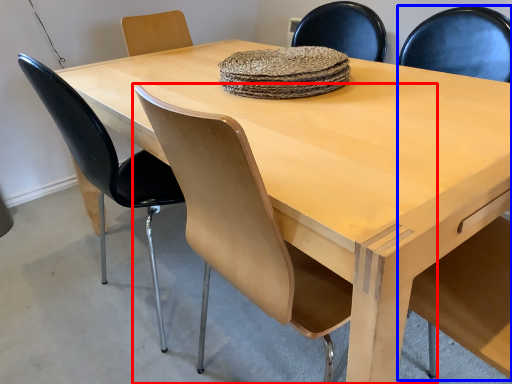
Question: Which object is further to the camera taking this photo, chair (highlighted by a red box) or armchair (highlighted by a blue box)?

Choices:
 (A) chair
 (B) armchair

Answer: (A)